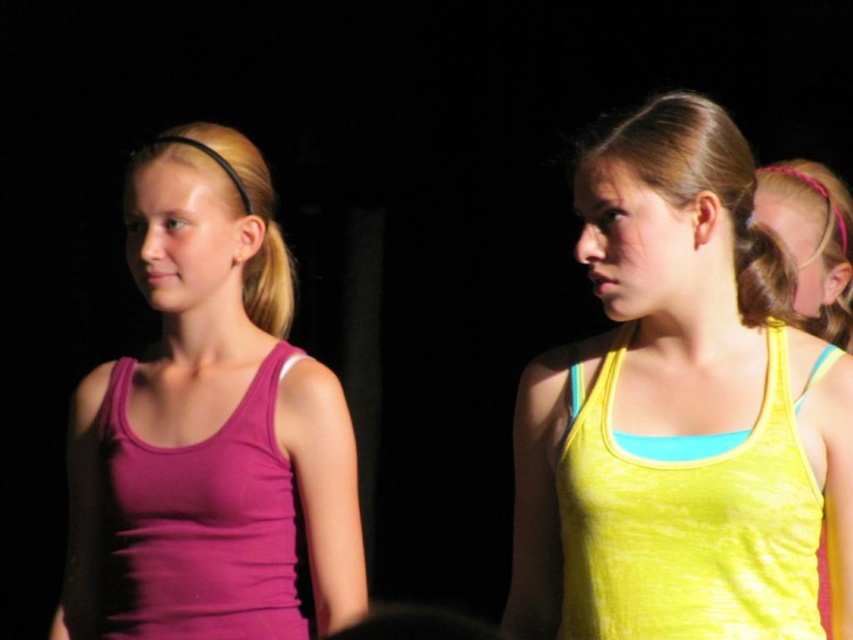
Does point (762, 605) come behind point (276, 321)?

No.

Is point (756, 545) closer to viewer compared to point (256, 253)?

Yes.

Find the location of a particular element. The image size is (853, 640). yellow fabric vest at right is located at coordinates (688, 522).

Is point (647, 506) positioned behind point (840, 196)?

That is False.

Is point (718, 452) in front of point (811, 276)?

Yes.

Does point (790, 451) come farther from viewer compared to point (840, 192)?

No, it is not.

This screenshot has height=640, width=853. In order to click on yellow matte tank top at center in this screenshot , I will do `click(682, 412)`.

Is point (154, 502) more distant than point (288, 269)?

No, (154, 502) is closer to viewer.

Describe the element at coordinates (198, 524) in the screenshot. I see `matte purple tank top at left` at that location.

Which is behind, point (149, 561) or point (276, 268)?

The point (276, 268) is behind.

Find the location of a particular element. The width and height of the screenshot is (853, 640). matte purple tank top at left is located at coordinates (198, 524).